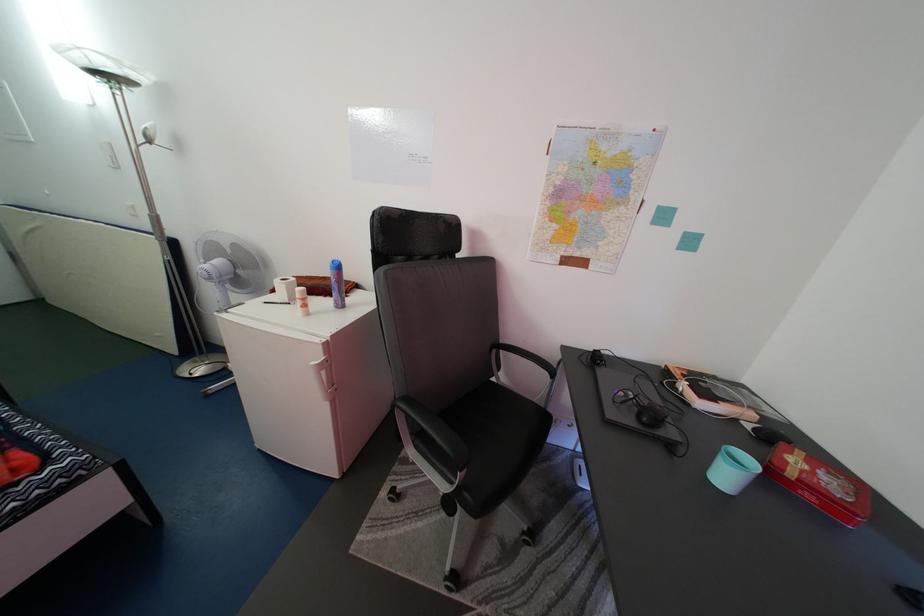
Identify the location of white fridge handle. (322, 379).